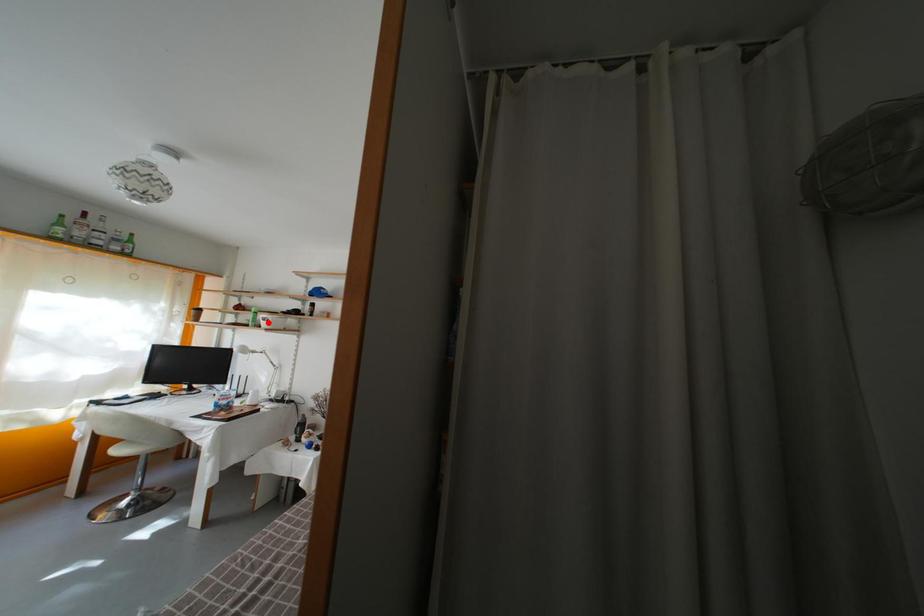
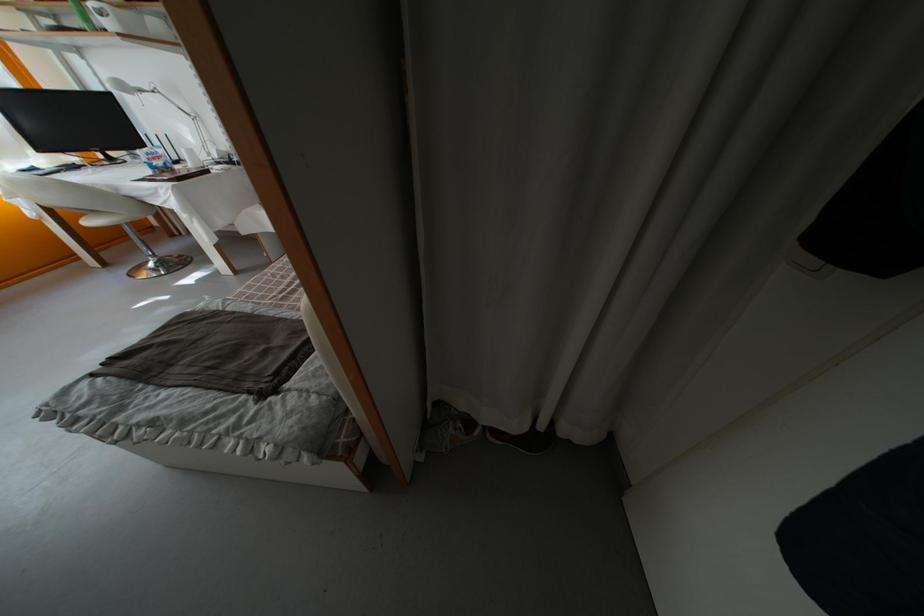
Question: I am providing you with two images of the same scene from different viewpoints. A red point is marked on the first image. At the location where the point appears in image 1, is it still visible in image 2?

Choices:
 (A) Yes
 (B) No

Answer: (A)